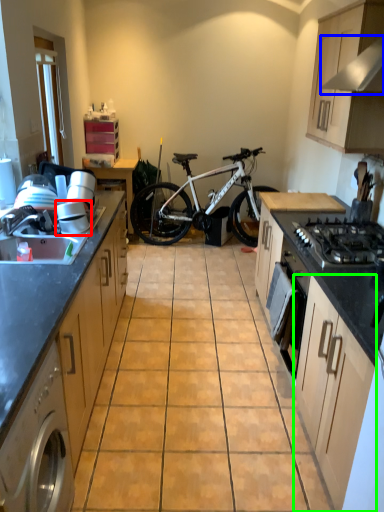
Question: Which is nearer to the appliance (highlighted by a red box)? exhaust hood (highlighted by a blue box) or cabinetry (highlighted by a green box).

Choices:
 (A) exhaust hood
 (B) cabinetry

Answer: (B)